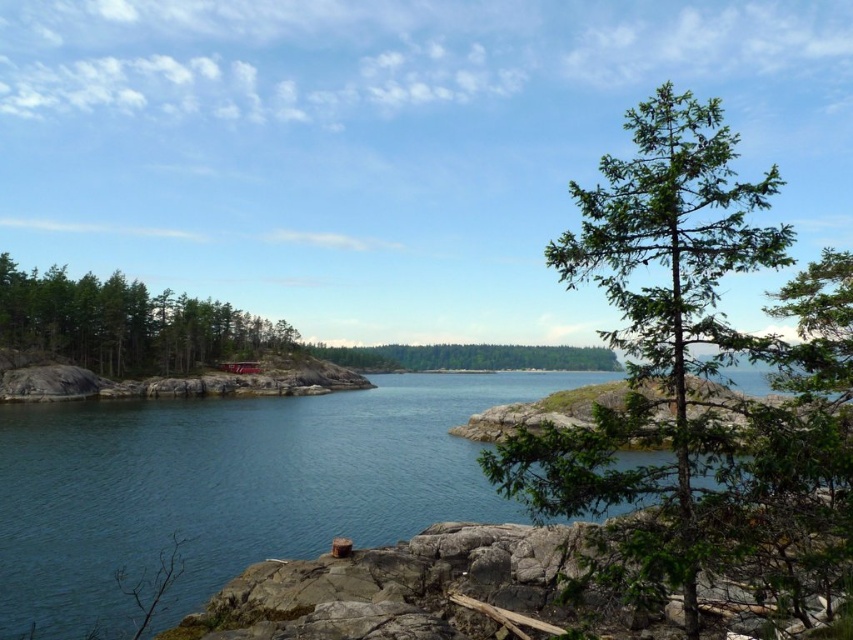
Question: Which object is positioned farthest from the green matte tree at left?

Choices:
 (A) green matte tree at center
 (B) green leafy tree at center

Answer: (B)

Question: Is blue water at center wider than green leafy tree at center?

Choices:
 (A) yes
 (B) no

Answer: (A)

Question: Is blue water at center thinner than green matte tree at left?

Choices:
 (A) yes
 (B) no

Answer: (B)

Question: Is green leafy tree at center closer to camera compared to green matte tree at center?

Choices:
 (A) no
 (B) yes

Answer: (B)

Question: Which point appears closest to the camera in this image?

Choices:
 (A) (573, 252)
 (B) (181, 358)

Answer: (A)

Question: Which point is farther to the camera?

Choices:
 (A) (65, 296)
 (B) (9, 531)
 (C) (674, 275)

Answer: (A)